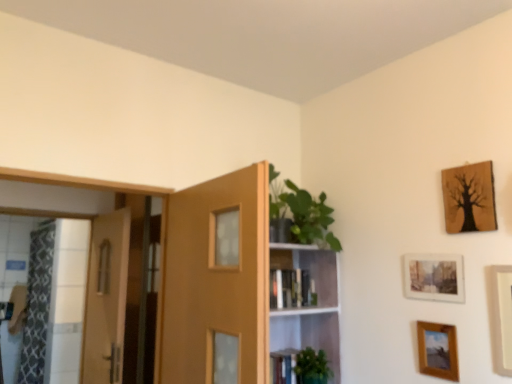
Question: In terms of height, does patterned fabric shower curtain at left look taller or shorter compared to green matte plant at lower center?

Choices:
 (A) short
 (B) tall

Answer: (B)

Question: Relative to green matte plant at lower center, is patterned fabric shower curtain at left in front or behind?

Choices:
 (A) front
 (B) behind

Answer: (B)

Question: Estimate the real-world distances between objects in this image. Which object is farther from the hardcover book at center?

Choices:
 (A) white matte picture frame at right, the 2th picture frame from the bottom
 (B) matte wood door at center, marked as the second door in a left-to-right arrangement
 (C) clear glass screen door at left
 (D) green glossy plant at upper center
 (E) patterned fabric shower curtain at left

Answer: (E)

Question: Which of these objects is positioned farthest from the white matte picture frame at right, the 2th picture frame from the bottom?

Choices:
 (A) hardcover book at center
 (B) clear glass screen door at left
 (C) green glossy plant at upper center
 (D) wooden tree art at upper right, the first picture frame in the top-to-bottom sequence
 (E) patterned fabric shower curtain at left

Answer: (E)